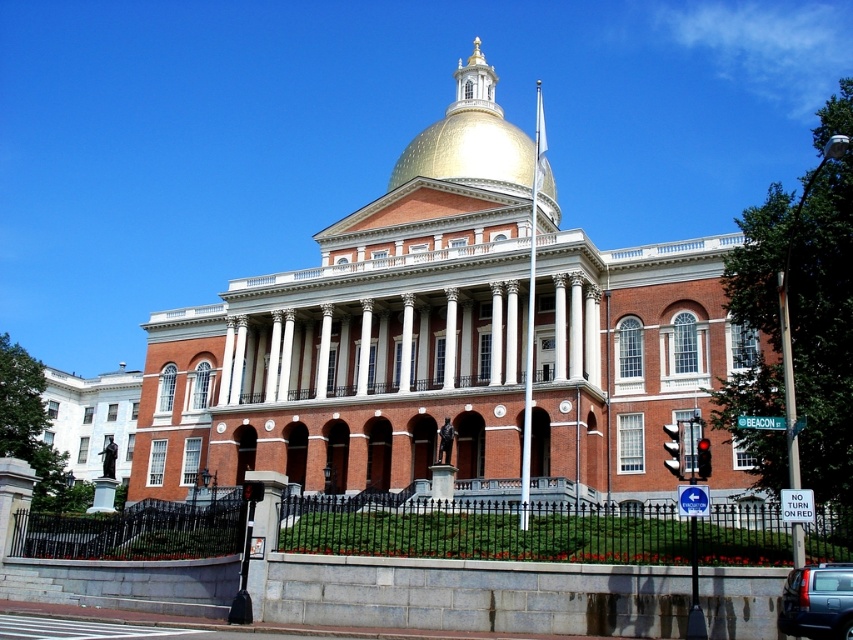
You are a photographer positioned at the front gate of the building. You want to capture both the gold polished dome at center and the metallic gray sedan at lower right in a single shot. Which direction should you turn your camera to include both objects in your frame?

You should turn your camera to the left to include both the gold polished dome at center and the metallic gray sedan at lower right in your frame, since the gold polished dome at center is positioned to the left of the metallic gray sedan at lower right.